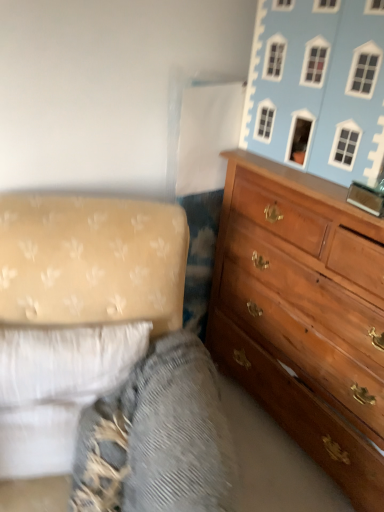
Question: From the image's perspective, would you say wooden dresser at right is shown under light blue painted wood dollhouse at upper right?

Choices:
 (A) yes
 (B) no

Answer: (A)

Question: From a real-world perspective, is wooden dresser at right positioned under light blue painted wood dollhouse at upper right based on gravity?

Choices:
 (A) yes
 (B) no

Answer: (A)

Question: From the image's perspective, does wooden dresser at right appear higher than light blue painted wood dollhouse at upper right?

Choices:
 (A) yes
 (B) no

Answer: (B)

Question: Is wooden dresser at right bigger than light blue painted wood dollhouse at upper right?

Choices:
 (A) no
 (B) yes

Answer: (B)

Question: Is wooden dresser at right wider than light blue painted wood dollhouse at upper right?

Choices:
 (A) no
 (B) yes

Answer: (B)

Question: Looking at the image, does white fabric studio couch at lower left seem bigger or smaller compared to wooden dresser at right?

Choices:
 (A) small
 (B) big

Answer: (A)

Question: From the image's perspective, relative to wooden dresser at right, is white fabric studio couch at lower left above or below?

Choices:
 (A) below
 (B) above

Answer: (A)

Question: Visually, is white fabric studio couch at lower left positioned to the left or to the right of wooden dresser at right?

Choices:
 (A) right
 (B) left

Answer: (B)

Question: In terms of height, does white fabric studio couch at lower left look taller or shorter compared to wooden dresser at right?

Choices:
 (A) tall
 (B) short

Answer: (B)

Question: In the image, is textured fabric at lower left on the left side or the right side of light blue painted wood dollhouse at upper right?

Choices:
 (A) left
 (B) right

Answer: (A)

Question: From the image's perspective, relative to light blue painted wood dollhouse at upper right, is textured fabric at lower left above or below?

Choices:
 (A) below
 (B) above

Answer: (A)

Question: Is textured fabric at lower left spatially inside light blue painted wood dollhouse at upper right, or outside of it?

Choices:
 (A) outside
 (B) inside

Answer: (A)

Question: From a real-world perspective, relative to light blue painted wood dollhouse at upper right, is textured fabric at lower left vertically above or below?

Choices:
 (A) above
 (B) below

Answer: (B)

Question: In terms of width, does light blue painted wood dollhouse at upper right look wider or thinner when compared to textured fabric at lower left?

Choices:
 (A) wide
 (B) thin

Answer: (B)

Question: Is light blue painted wood dollhouse at upper right spatially inside textured fabric at lower left, or outside of it?

Choices:
 (A) inside
 (B) outside

Answer: (B)